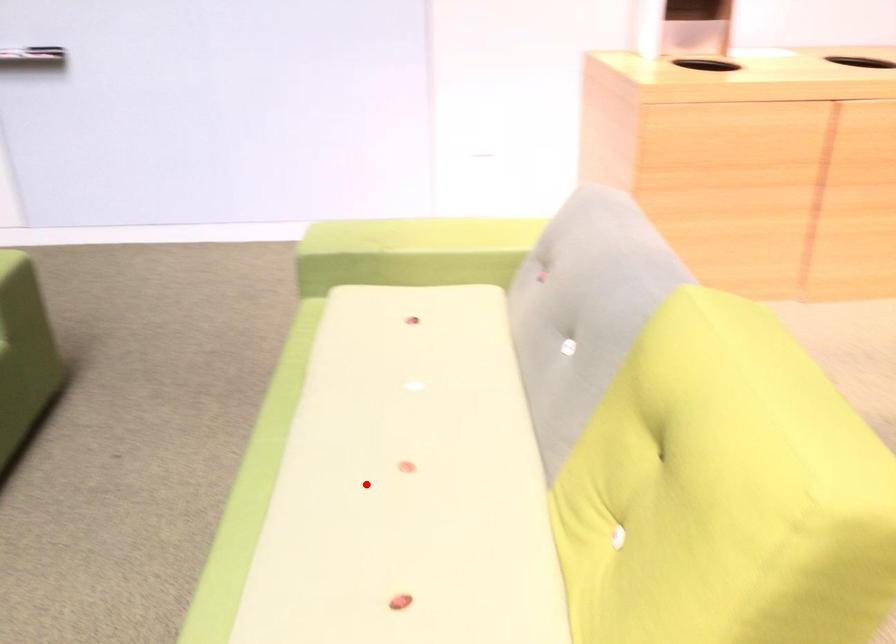
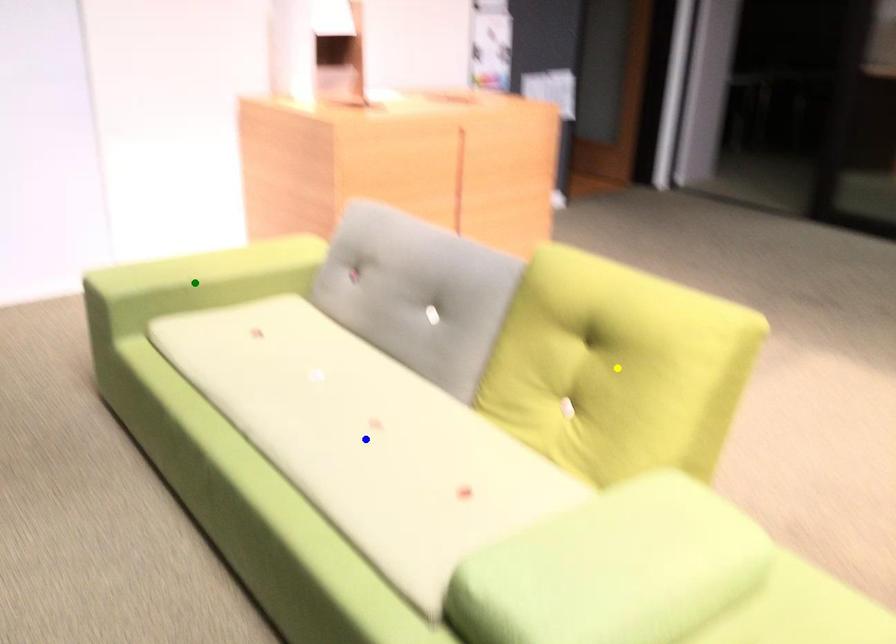
Question: I am providing you with two images of the same scene from different viewpoints. A red point is marked on the first image. You are given multiple points on the second image. Can you choose the point in image 2 that corresponds to the point in image 1?

Choices:
 (A) blue point
 (B) green point
 (C) yellow point

Answer: (A)